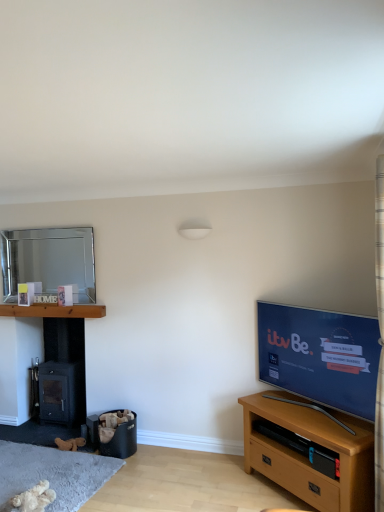
Question: Is wooden at left, which appears as the first shelf when viewed from the left, completely or partially inside silver metallic mirror at upper left?

Choices:
 (A) no
 (B) yes

Answer: (A)

Question: Is silver metallic mirror at upper left outside wooden at left, the first shelf when ordered from back to front?

Choices:
 (A) yes
 (B) no

Answer: (A)

Question: From a real-world perspective, does silver metallic mirror at upper left stand above wooden at left, the 2th shelf from the front?

Choices:
 (A) no
 (B) yes

Answer: (B)

Question: Is silver metallic mirror at upper left at the left side of wooden at left, the second shelf in the right-to-left sequence?

Choices:
 (A) yes
 (B) no

Answer: (A)

Question: Is silver metallic mirror at upper left looking in the opposite direction of wooden at left, the 2th shelf from the front?

Choices:
 (A) no
 (B) yes

Answer: (A)

Question: Considering the positions of plaid fabric curtain at upper right and silver metallic mirror at upper left in the image, is plaid fabric curtain at upper right taller or shorter than silver metallic mirror at upper left?

Choices:
 (A) tall
 (B) short

Answer: (A)

Question: From a real-world perspective, relative to silver metallic mirror at upper left, is plaid fabric curtain at upper right vertically above or below?

Choices:
 (A) above
 (B) below

Answer: (B)

Question: Relative to silver metallic mirror at upper left, is plaid fabric curtain at upper right in front or behind?

Choices:
 (A) front
 (B) behind

Answer: (A)

Question: Considering the positions of plaid fabric curtain at upper right and silver metallic mirror at upper left in the image, is plaid fabric curtain at upper right bigger or smaller than silver metallic mirror at upper left?

Choices:
 (A) big
 (B) small

Answer: (A)

Question: From a real-world perspective, relative to light brown wooden tv stand at lower right, is plaid fabric curtain at upper right vertically above or below?

Choices:
 (A) below
 (B) above

Answer: (B)

Question: Relative to light brown wooden tv stand at lower right, is plaid fabric curtain at upper right in front or behind?

Choices:
 (A) behind
 (B) front

Answer: (B)

Question: Does point click(x=377, y=160) appear closer or farther from the camera than point click(x=317, y=415)?

Choices:
 (A) closer
 (B) farther

Answer: (A)

Question: Looking at the image, does plaid fabric curtain at upper right seem bigger or smaller compared to light brown wooden tv stand at lower right?

Choices:
 (A) small
 (B) big

Answer: (A)

Question: From the image's perspective, is fluffy beige teddy bear at lower left above or below wooden tv stand at lower right, which ranks as the 1th shelf in bottom-to-top order?

Choices:
 (A) below
 (B) above

Answer: (A)

Question: Is fluffy beige teddy bear at lower left taller or shorter than wooden tv stand at lower right, the 2th shelf when ordered from left to right?

Choices:
 (A) short
 (B) tall

Answer: (A)